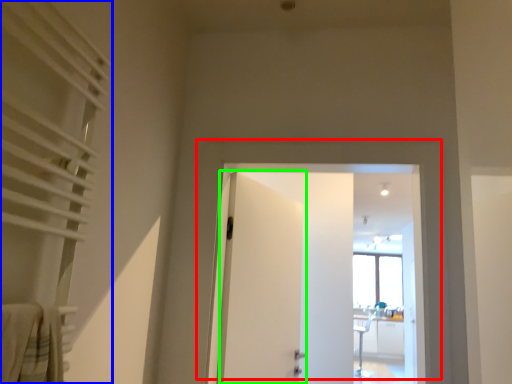
Question: Based on their relative distances, which object is nearer to door (highlighted by a red box)? Choose from curtain (highlighted by a blue box) and door (highlighted by a green box).

Choices:
 (A) curtain
 (B) door

Answer: (B)